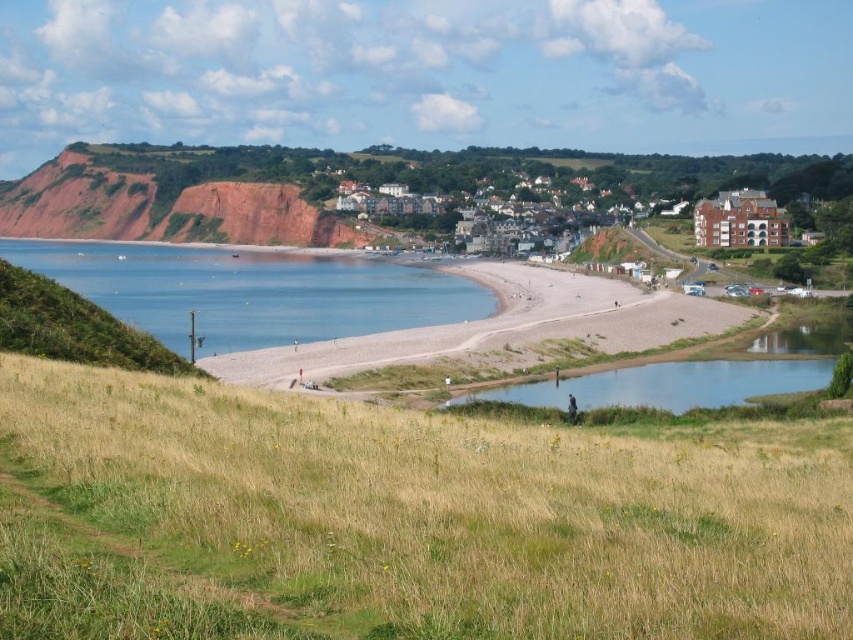
Is green grassy field at lower left to the right of rustic clay cliff at upper left from the viewer's perspective?

Correct, you'll find green grassy field at lower left to the right of rustic clay cliff at upper left.

Can you confirm if green grassy field at lower left is positioned above rustic clay cliff at upper left?

Incorrect, green grassy field at lower left is not positioned above rustic clay cliff at upper left.

Between point (844, 536) and point (306, 212), which one is positioned in front?

Point (844, 536)

Locate an element on the screen. Image resolution: width=853 pixels, height=640 pixels. green grassy field at lower left is located at coordinates (399, 522).

Is rustic clay cliff at upper left above brown brick buildings at center?

Yes.

Is point (88, 188) positioned before point (463, 193)?

No, it is behind (463, 193).

Is point (368, 240) closer to viewer compared to point (767, 221)?

No, it is not.

This screenshot has height=640, width=853. I want to click on rustic clay cliff at upper left, so click(161, 202).

Who is more forward, (425, 301) or (612, 332)?

Point (612, 332) is more forward.

Is blue water at lower left thinner than smooth sand beach at center?

In fact, blue water at lower left might be wider than smooth sand beach at center.

Between point (373, 284) and point (634, 349), which one is positioned in front?

Point (634, 349) is more forward.

The width and height of the screenshot is (853, 640). I want to click on blue water at lower left, so click(x=251, y=291).